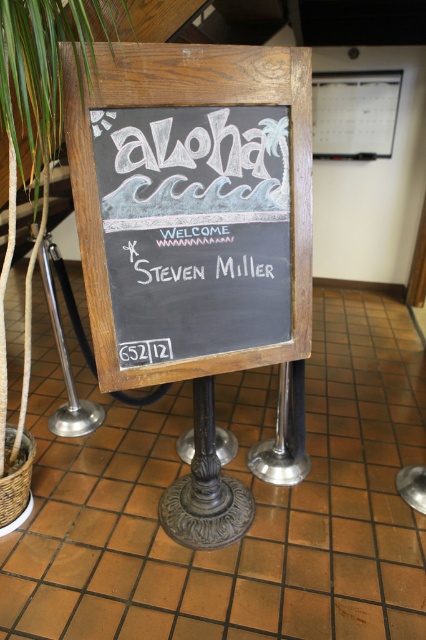
Is point (143, 376) more distant than point (45, 56)?

Yes, it is.

Can you confirm if chalkboard at center is bigger than green leafy plant at left?

Actually, chalkboard at center might be smaller than green leafy plant at left.

Between point (147, 141) and point (0, 285), which one is positioned in front?

Point (147, 141) is more forward.

Where is `chalkboard at center`? The height and width of the screenshot is (640, 426). chalkboard at center is located at coordinates tap(192, 208).

Looking at this image, can you confirm if chalkboard at center is taller than white chalk writing at center?

Indeed, chalkboard at center has a greater height compared to white chalk writing at center.

Is chalkboard at center positioned at the back of white chalk writing at center?

No, chalkboard at center is closer to the viewer.

Locate an element on the screen. chalkboard at center is located at coordinates (192, 208).

This screenshot has width=426, height=640. What are the coordinates of `chalkboard at center` in the screenshot? It's located at (192, 208).

Who is higher up, green leafy plant at left or white chalk writing at center?

green leafy plant at left

Between green leafy plant at left and white chalk writing at center, which one has less height?

Standing shorter between the two is white chalk writing at center.

Which is behind, point (11, 51) or point (120, 241)?

The point (120, 241) is more distant.

This screenshot has width=426, height=640. Find the location of `green leafy plant at left`. green leafy plant at left is located at coordinates (32, 106).